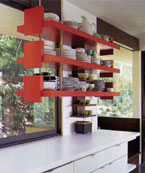
You are a GUI agent. You are given a task and a screenshot of the screen. Output one action in this format:
    pyautogui.click(x=<x>, y=<y>)
    Task: Click on the stack of bowls
    The image size is (145, 173).
    Given the screenshot: What is the action you would take?
    pyautogui.click(x=99, y=86), pyautogui.click(x=71, y=23)